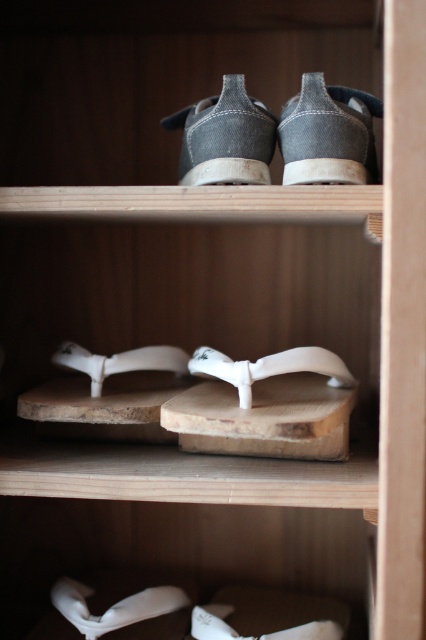
You are trying to place a small decorative item between the white rubber sandal at center and the white matte sandal at center on the shoe rack. The item is 5 inches long. Will it fit in the space between them?

The distance between the white rubber sandal at center and the white matte sandal at center is 4.30 inches, so the 5 inch item will not fit between them as it is longer than the available space.

You are organizing a shoe display and need to place a new pair of shoes between the dark gray canvas shoe at upper center and the white matte sandal at center. Based on their positions, which side should you place the new shoes on to maintain symmetry?

The dark gray canvas shoe at upper center is to the right of the white matte sandal at center, so to maintain symmetry, the new shoes should be placed to the left of the white matte sandal at center.

You are organizing a shoe display in a store and need to ensure that the dark gray canvas shoe at upper center and the white matte sandal at center fit on a narrow shelf. Which shoe should you place first to maximize space?

The dark gray canvas shoe at upper center is thinner than the white matte sandal at center, so you should place the dark gray canvas shoe at upper center first to maximize space on the narrow shelf.